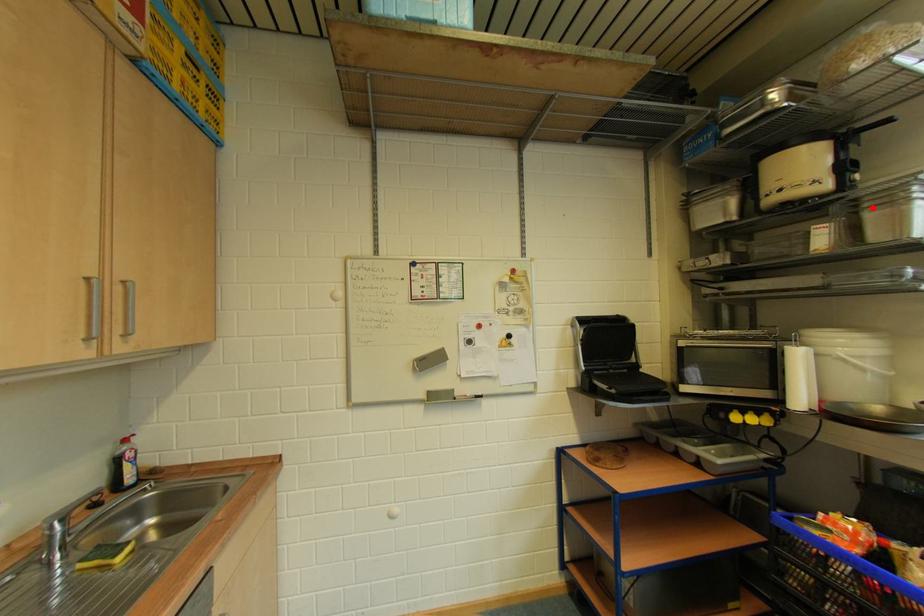
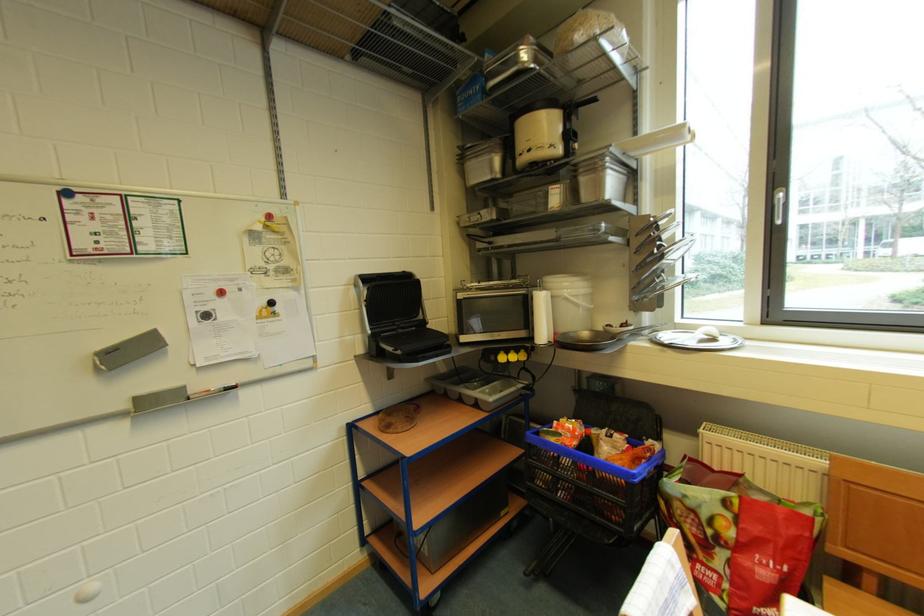
Where in the second image is the point corresponding to the highlighted location from the first image?

(589, 174)